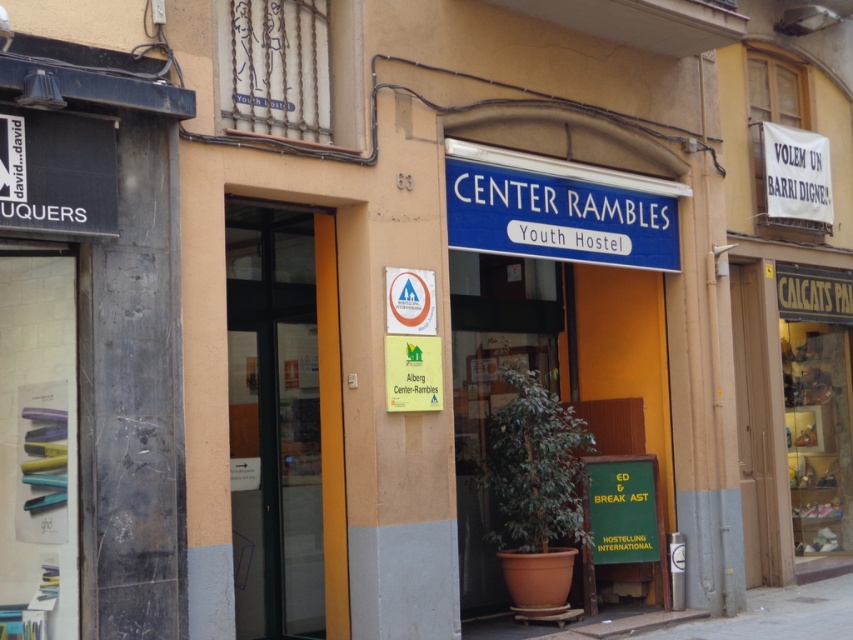
Is blue plastic sign at center wider than green matte signboard at lower right?

Yes.

Is point (583, 228) closer to viewer compared to point (592, 536)?

Yes.

The height and width of the screenshot is (640, 853). What are the coordinates of `blue plastic sign at center` in the screenshot? It's located at (558, 218).

Is transparent glass door at center shorter than blue plastic sign at center?

No, transparent glass door at center is not shorter than blue plastic sign at center.

Is the position of transparent glass door at center less distant than that of blue plastic sign at center?

No, transparent glass door at center is behind blue plastic sign at center.

Describe the element at coordinates (285, 422) in the screenshot. I see `transparent glass door at center` at that location.

This screenshot has height=640, width=853. I want to click on transparent glass door at center, so click(x=285, y=422).

Can you confirm if transparent glass door at center is positioned to the left of gray concrete pavement at lower center?

Yes, transparent glass door at center is to the left of gray concrete pavement at lower center.

Is transparent glass door at center behind gray concrete pavement at lower center?

No.

Identify the location of transparent glass door at center. The width and height of the screenshot is (853, 640). (285, 422).

Find the location of a particular element. This screenshot has height=640, width=853. transparent glass door at center is located at coordinates (285, 422).